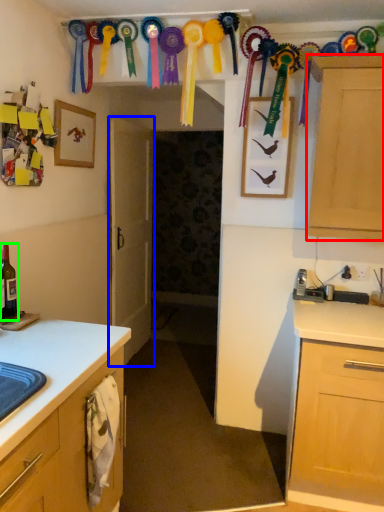
Question: Considering the real-world distances, which object is farthest from cabinetry (highlighted by a red box)? door (highlighted by a blue box) or beer bottle (highlighted by a green box)?

Choices:
 (A) door
 (B) beer bottle

Answer: (A)